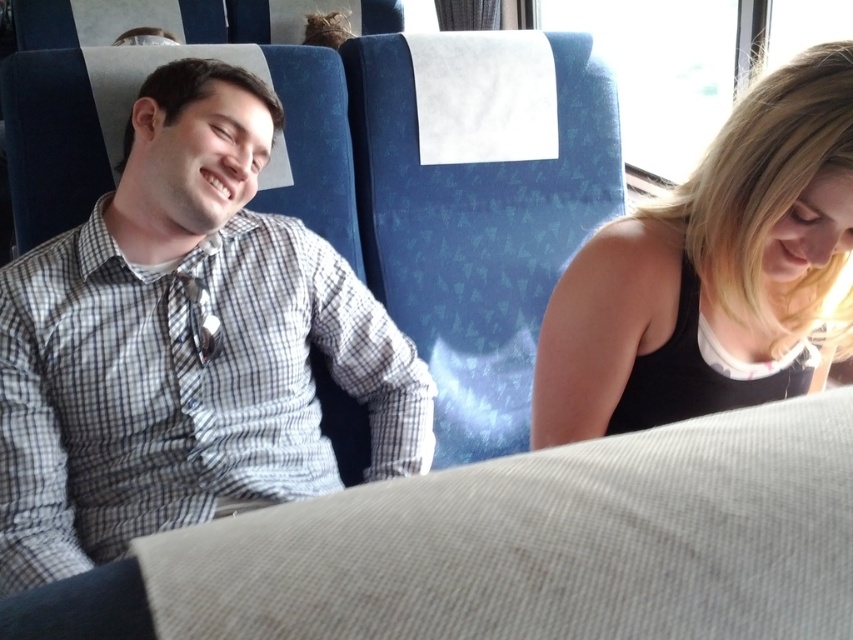
Question: Among these points, which one is farthest from the camera?

Choices:
 (A) (672, 252)
 (B) (373, 388)

Answer: (B)

Question: Does checkered fabric shirt at left have a larger size compared to black tank top at right?

Choices:
 (A) yes
 (B) no

Answer: (A)

Question: Is checkered fabric shirt at left closer to camera compared to black tank top at right?

Choices:
 (A) no
 (B) yes

Answer: (A)

Question: Does checkered fabric shirt at left appear under black tank top at right?

Choices:
 (A) no
 (B) yes

Answer: (A)

Question: Which of the following is the farthest from the observer?

Choices:
 (A) (67, 310)
 (B) (670, 198)

Answer: (A)